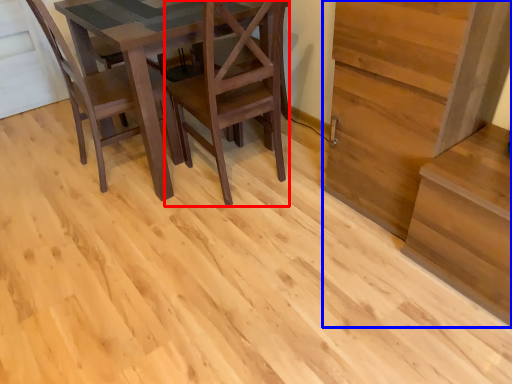
Question: Which of the following is the closest to the observer, chair (highlighted by a red box) or stairwell (highlighted by a blue box)?

Choices:
 (A) chair
 (B) stairwell

Answer: (B)